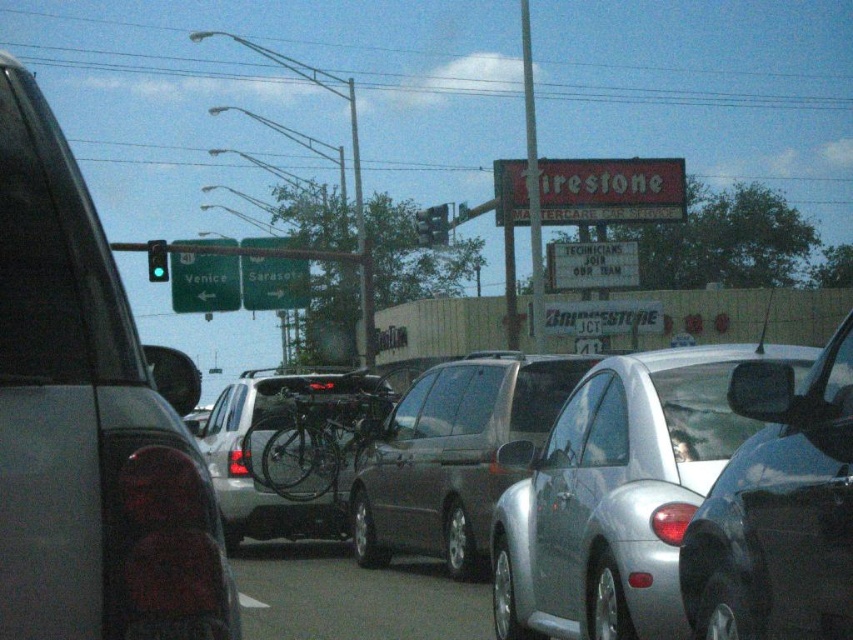
Is matte black car at left bigger than silver metallic car at center?

Incorrect, matte black car at left is not larger than silver metallic car at center.

Can you confirm if matte black car at left is taller than silver metallic car at center?

In fact, matte black car at left may be shorter than silver metallic car at center.

Is point (117, 452) more distant than point (552, 548)?

No, (117, 452) is closer to viewer.

Identify the location of matte black car at left. (90, 420).

Is matte black car at left closer to the viewer compared to metallic silver bicycle at center?

Yes, it is.

Is matte black car at left below metallic silver bicycle at center?

No.

Is point (24, 214) closer to viewer compared to point (207, 429)?

Yes, point (24, 214) is closer to viewer.

This screenshot has width=853, height=640. I want to click on matte black car at left, so click(x=90, y=420).

Does metallic silver bicycle at center appear on the right side of green glass traffic light at upper center?

Indeed, metallic silver bicycle at center is positioned on the right side of green glass traffic light at upper center.

Who is shorter, metallic silver bicycle at center or green glass traffic light at upper center?

With less height is green glass traffic light at upper center.

Describe the element at coordinates (271, 454) in the screenshot. I see `metallic silver bicycle at center` at that location.

Locate an element on the screen. The width and height of the screenshot is (853, 640). metallic silver bicycle at center is located at coordinates (271, 454).